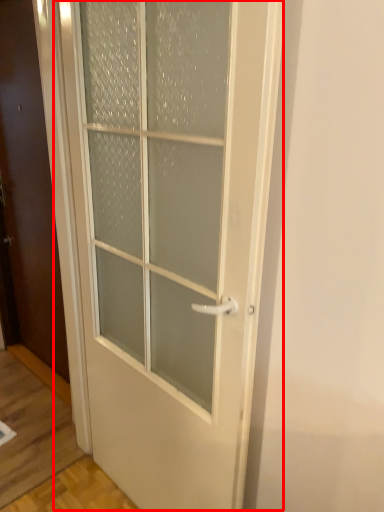
Question: From the image's perspective, where is door (annotated by the red box) located relative to door?

Choices:
 (A) above
 (B) below

Answer: (B)